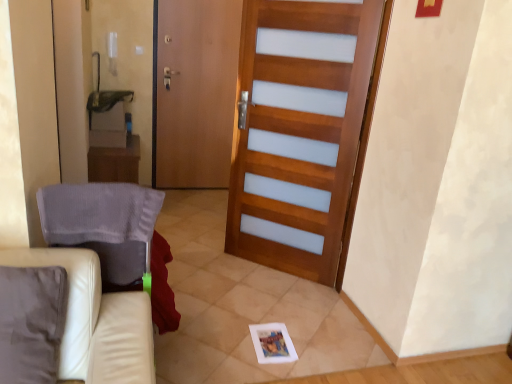
I want to click on free region under wooden screen door at center (from a real-world perspective), so click(184, 190).